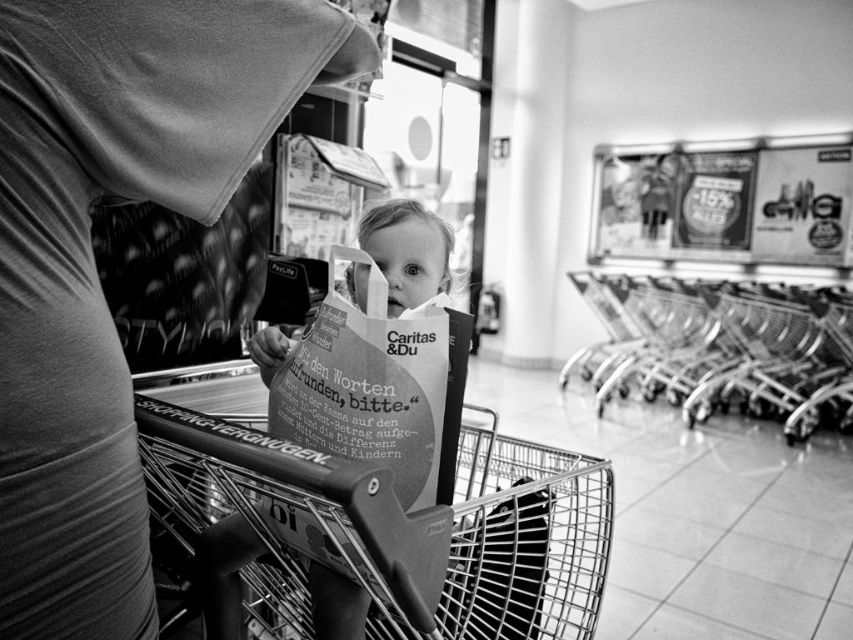
Question: Which is farther from the metallic shopping cart at center?

Choices:
 (A) matte black shirt at center
 (B) white paper bag at center
 (C) metallic silver trolley at right

Answer: (C)

Question: Which of these objects is positioned closest to the metallic shopping cart at center?

Choices:
 (A) matte black shirt at center
 (B) metallic silver trolley at right
 (C) white paper bag at center

Answer: (C)

Question: Is metallic shopping cart at center further to camera compared to metallic silver trolley at right?

Choices:
 (A) yes
 (B) no

Answer: (B)

Question: Does matte black shirt at center appear on the left side of white paper bag at center?

Choices:
 (A) no
 (B) yes

Answer: (B)

Question: Which of these objects is positioned farthest from the matte black shirt at center?

Choices:
 (A) metallic silver trolley at right
 (B) white paper bag at center

Answer: (A)

Question: Can you confirm if metallic silver trolley at right is positioned to the right of white paper bag at center?

Choices:
 (A) no
 (B) yes

Answer: (B)